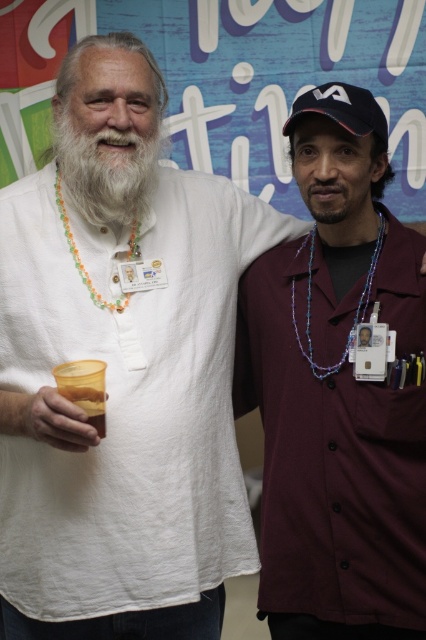
Is whitewool-likebeard at left further to the viewer compared to multicolored beaded necklace at left?

No, it is in front of multicolored beaded necklace at left.

Does point (62, 148) come closer to viewer compared to point (135, 241)?

Yes, point (62, 148) is in front of point (135, 241).

Identify the location of whitewool-likebeard at left. (106, 172).

Is dark brown fuzzy beard at center below multicolored beaded necklace at left?

Incorrect, dark brown fuzzy beard at center is not positioned below multicolored beaded necklace at left.

Describe the element at coordinates (336, 198) in the screenshot. I see `dark brown fuzzy beard at center` at that location.

I want to click on dark brown fuzzy beard at center, so click(x=336, y=198).

Image resolution: width=426 pixels, height=640 pixels. What do you see at coordinates (336, 198) in the screenshot?
I see `dark brown fuzzy beard at center` at bounding box center [336, 198].

Is dark brown fuzzy beard at center further to the viewer compared to blue beaded necklace at center?

Yes.

Image resolution: width=426 pixels, height=640 pixels. In order to click on dark brown fuzzy beard at center in this screenshot , I will do `click(336, 198)`.